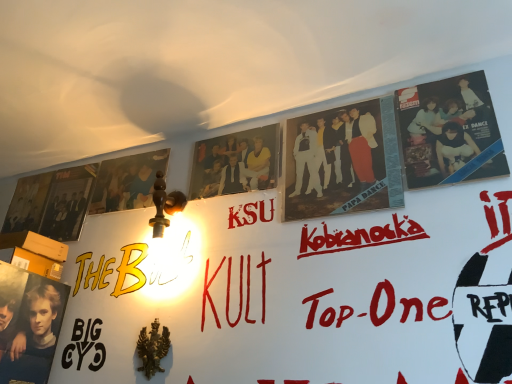
Question: Considering the relative sizes of matte black album cover at left, which is the second poster from right to left, and matte black poster at lower left, which ranks as the first person in left-to-right order, in the image provided, is matte black album cover at left, which is the second poster from right to left, bigger than matte black poster at lower left, which ranks as the first person in left-to-right order,?

Choices:
 (A) yes
 (B) no

Answer: (B)

Question: Is matte black poster at lower left, which ranks as the first person in left-to-right order, a part of matte black album cover at left, which is the second poster from right to left?

Choices:
 (A) yes
 (B) no

Answer: (B)

Question: Is matte black album cover at left, positioned as the 1th poster in left-to-right order, positioned with its back to matte black poster at lower left, which ranks as the first person in left-to-right order?

Choices:
 (A) no
 (B) yes

Answer: (A)

Question: From the image's perspective, is matte black album cover at left, which is the second poster from right to left, located beneath matte black poster at lower left, which ranks as the first person in left-to-right order?

Choices:
 (A) yes
 (B) no

Answer: (B)

Question: From a real-world perspective, is matte black album cover at left, which is the second poster from right to left, beneath matte black poster at lower left, the fourth person from the right?

Choices:
 (A) no
 (B) yes

Answer: (A)

Question: From their relative heights in the image, would you say matte black album cover at left, positioned as the 1th poster in left-to-right order, is taller or shorter than matte black poster at lower left, which ranks as the first person in left-to-right order?

Choices:
 (A) tall
 (B) short

Answer: (B)

Question: Is point (69, 195) positioned closer to the camera than point (41, 317)?

Choices:
 (A) farther
 (B) closer

Answer: (A)

Question: In the image, is matte black album cover at left, positioned as the 1th poster in left-to-right order, positioned in front of or behind matte black poster at lower left, which ranks as the first person in left-to-right order?

Choices:
 (A) front
 (B) behind

Answer: (B)

Question: From a real-world perspective, relative to matte black poster at lower left, the fourth person from the right, is matte black album cover at left, positioned as the 1th poster in left-to-right order, vertically above or below?

Choices:
 (A) below
 (B) above

Answer: (B)

Question: In the image, is matte black movie poster at upper left on the left side or the right side of matte black album cover at left, which is the second poster from right to left?

Choices:
 (A) left
 (B) right

Answer: (A)

Question: Does point (20, 226) appear closer or farther from the camera than point (53, 236)?

Choices:
 (A) farther
 (B) closer

Answer: (A)

Question: Relative to matte black album cover at left, which is the second poster from right to left, is matte black movie poster at upper left in front or behind?

Choices:
 (A) behind
 (B) front

Answer: (A)

Question: Based on their sizes in the image, would you say matte black movie poster at upper left is bigger or smaller than matte black album cover at left, positioned as the 1th poster in left-to-right order?

Choices:
 (A) small
 (B) big

Answer: (A)

Question: Is matte black poster at lower left, which ranks as the first person in left-to-right order, inside the boundaries of matte yellow shirt at center, marked as the second person in a left-to-right arrangement, or outside?

Choices:
 (A) inside
 (B) outside

Answer: (B)

Question: From a real-world perspective, is matte black poster at lower left, which ranks as the first person in left-to-right order, above or below matte yellow shirt at center, which is the 3th person from right to left?

Choices:
 (A) above
 (B) below

Answer: (B)